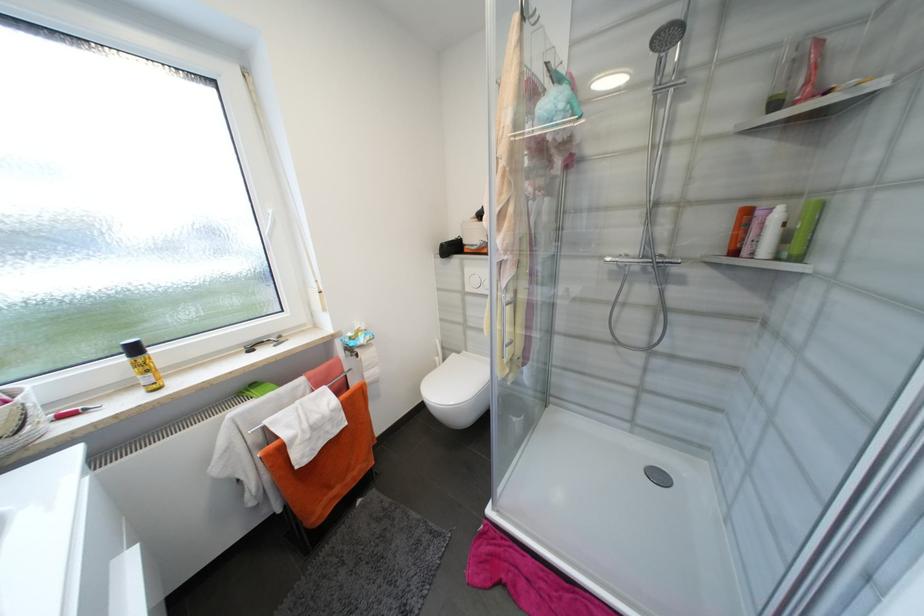
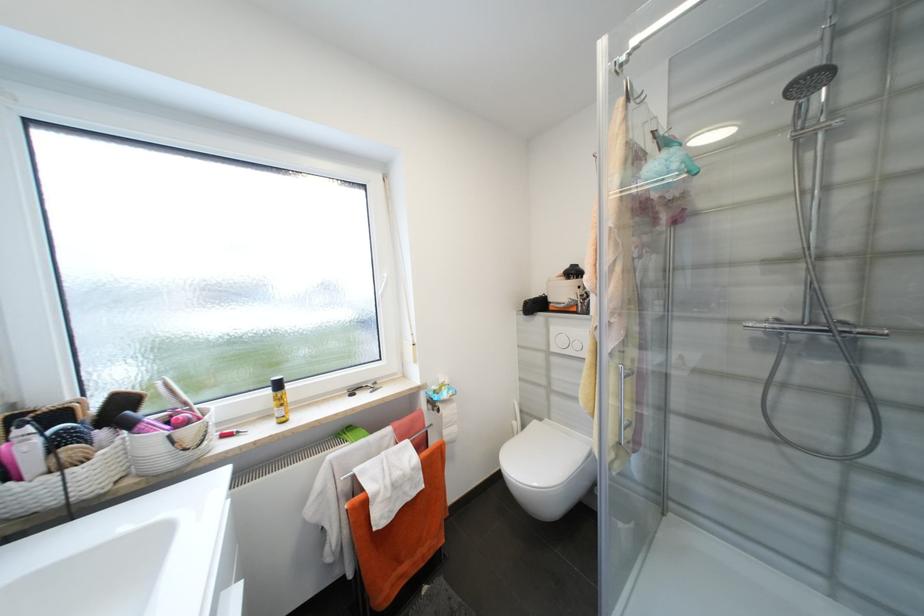
Where in the second image is the point corresponding to point 566,107 from the first image?

(681, 167)